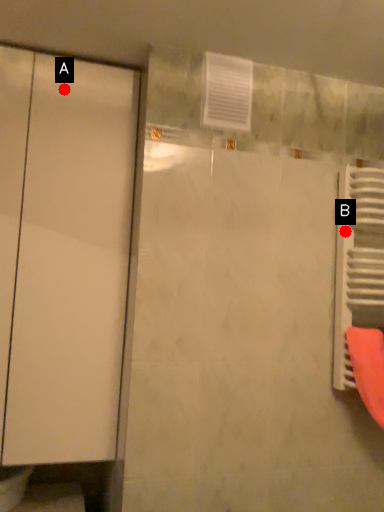
Question: Two points are circled on the image, labeled by A and B beside each circle. Which of the following is the closest to the observer?

Choices:
 (A) A is closer
 (B) B is closer

Answer: (A)